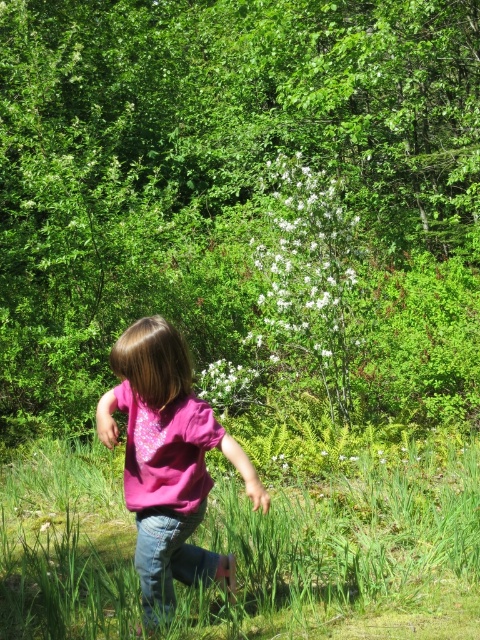
Is green grassy at center positioned before white fluffy flowers at center?

Yes, green grassy at center is closer to the viewer.

How distant is green grassy at center from white fluffy flowers at center?

green grassy at center is 6.46 feet away from white fluffy flowers at center.

Describe the element at coordinates (348, 552) in the screenshot. I see `green grassy at center` at that location.

Find the location of a particular element. This screenshot has width=480, height=640. green grassy at center is located at coordinates (348, 552).

Does green grassy at center come in front of white matte flower at center?

Yes.

Which is more to the right, green grassy at center or white matte flower at center?

green grassy at center is more to the right.

The height and width of the screenshot is (640, 480). Describe the element at coordinates (348, 552) in the screenshot. I see `green grassy at center` at that location.

Image resolution: width=480 pixels, height=640 pixels. I want to click on green grassy at center, so click(348, 552).

In the scene shown: Who is more forward, (139, 451) or (303, 275)?

Point (139, 451) is in front.

At what (x,y) coordinates should I click in order to perform the action: click on pink cotton shirt at center. Please return your answer as a coordinate pair (x, y). The height and width of the screenshot is (640, 480). Looking at the image, I should click on (168, 460).

Who is more distant from viewer, (171, 456) or (292, 314)?

Positioned behind is point (292, 314).

Where is `pink cotton shirt at center`? pink cotton shirt at center is located at coordinates pyautogui.click(x=168, y=460).